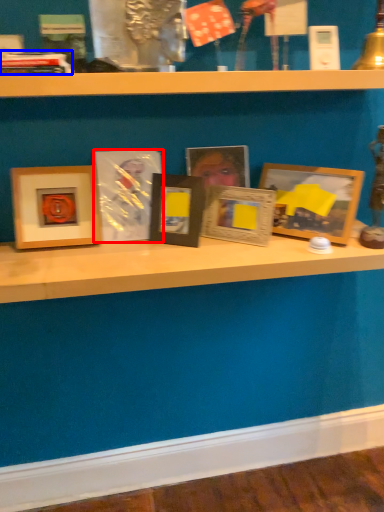
Question: Which object appears closest to the camera in this image, picture frame (highlighted by a red box) or book (highlighted by a blue box)?

Choices:
 (A) picture frame
 (B) book

Answer: (B)